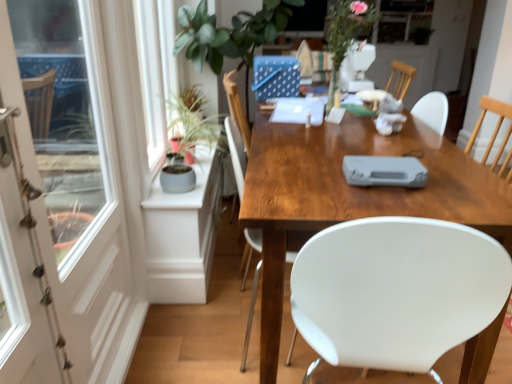
This screenshot has height=384, width=512. What are the coordinates of `wooden desk at center` in the screenshot? It's located at (352, 195).

Describe the element at coordinates (81, 172) in the screenshot. I see `white glossy screen door at left, marked as the 2th screen door in a right-to-left arrangement` at that location.

You are a GUI agent. You are given a task and a screenshot of the screen. Output one action in this format:
    pyautogui.click(x=<x>, y=<y>)
    Task: Click on the white glossy screen door at left, marked as the 2th screen door in a right-to-left arrangement
    This screenshot has height=384, width=512.
    Given the screenshot: What is the action you would take?
    pyautogui.click(x=81, y=172)

Locate an element on the screen. This screenshot has width=512, height=384. white plastic game console at center is located at coordinates (384, 171).

Describe the element at coordinates (345, 35) in the screenshot. I see `floral arrangement at upper center` at that location.

Locate an element on the screen. This screenshot has width=512, height=384. metallic silver screen door at left, placed as the 2th screen door when sorted from left to right is located at coordinates (26, 212).

Is metallic silver screen door at left, placed as the 2th screen door when sorted from left to right, facing away from white plastic game console at center?

No, white plastic game console at center is not at the back of metallic silver screen door at left, placed as the 2th screen door when sorted from left to right.

Does point (40, 315) come behind point (349, 164)?

That is False.

From a real-world perspective, is metallic silver screen door at left, which is the 1th screen door from right to left, above or below white plastic game console at center?

Clearly, from a real-world perspective, metallic silver screen door at left, which is the 1th screen door from right to left, is below white plastic game console at center.

From the image's perspective, is white glossy screen door at left, marked as the 2th screen door in a right-to-left arrangement, under metallic silver screen door at left, placed as the 2th screen door when sorted from left to right?

No.

Are white glossy screen door at left, acting as the 1th screen door starting from the left, and metallic silver screen door at left, which is the 1th screen door from right to left, beside each other?

There is a gap between white glossy screen door at left, acting as the 1th screen door starting from the left, and metallic silver screen door at left, which is the 1th screen door from right to left.

Which of these two, white glossy screen door at left, acting as the 1th screen door starting from the left, or metallic silver screen door at left, placed as the 2th screen door when sorted from left to right, is thinner?

Thinner between the two is metallic silver screen door at left, placed as the 2th screen door when sorted from left to right.

Could you tell me if white glossy screen door at left, acting as the 1th screen door starting from the left, is turned towards metallic silver screen door at left, placed as the 2th screen door when sorted from left to right?

No, white glossy screen door at left, acting as the 1th screen door starting from the left, is not facing towards metallic silver screen door at left, placed as the 2th screen door when sorted from left to right.

How many degrees apart are the facing directions of white glossy screen door at left, acting as the 1th screen door starting from the left, and floral arrangement at upper center?

3.32 degrees.

Is point (30, 298) in front of point (371, 22)?

Yes.

Is white glossy screen door at left, marked as the 2th screen door in a right-to-left arrangement, oriented towards floral arrangement at upper center?

No, white glossy screen door at left, marked as the 2th screen door in a right-to-left arrangement, is not facing towards floral arrangement at upper center.

Is white glossy screen door at left, marked as the 2th screen door in a right-to-left arrangement, positioned beyond the bounds of floral arrangement at upper center?

Indeed, white glossy screen door at left, marked as the 2th screen door in a right-to-left arrangement, is completely outside floral arrangement at upper center.

Measure the distance from floral arrangement at upper center to white plastic game console at center.

floral arrangement at upper center and white plastic game console at center are 91.11 centimeters apart.

From a real-world perspective, does floral arrangement at upper center stand above white plastic game console at center?

Yes, from a real-world perspective, floral arrangement at upper center is on top of white plastic game console at center.

Is floral arrangement at upper center positioned before white plastic game console at center?

No, floral arrangement at upper center is behind white plastic game console at center.

How different are the orientations of floral arrangement at upper center and white plastic game console at center in degrees?

94.6 degrees separate the facing orientations of floral arrangement at upper center and white plastic game console at center.

Is metallic silver screen door at left, which is the 1th screen door from right to left, further to the viewer compared to white glossy screen door at left, marked as the 2th screen door in a right-to-left arrangement?

That is True.

How different are the orientations of metallic silver screen door at left, which is the 1th screen door from right to left, and white glossy screen door at left, acting as the 1th screen door starting from the left, in degrees?

They differ by 1.24 degrees in their facing directions.

The width and height of the screenshot is (512, 384). I want to click on screen door lying in front of the metallic silver screen door at left, which is the 1th screen door from right to left, so click(81, 172).

Does metallic silver screen door at left, placed as the 2th screen door when sorted from left to right, have a greater width compared to floral arrangement at upper center?

No.

Which is farther from the camera, (x=5, y=221) or (x=348, y=44)?

The point (x=348, y=44) is farther.

Is metallic silver screen door at left, placed as the 2th screen door when sorted from left to right, spatially inside floral arrangement at upper center, or outside of it?

metallic silver screen door at left, placed as the 2th screen door when sorted from left to right, is not enclosed by floral arrangement at upper center.

Visually, is floral arrangement at upper center positioned to the left or to the right of metallic silver screen door at left, which is the 1th screen door from right to left?

floral arrangement at upper center is to the right of metallic silver screen door at left, which is the 1th screen door from right to left.

From a real-world perspective, is floral arrangement at upper center positioned above or below metallic silver screen door at left, which is the 1th screen door from right to left?

Clearly, from a real-world perspective, floral arrangement at upper center is above metallic silver screen door at left, which is the 1th screen door from right to left.

Measure the distance from floral arrangement at upper center to metallic silver screen door at left, placed as the 2th screen door when sorted from left to right.

The distance of floral arrangement at upper center from metallic silver screen door at left, placed as the 2th screen door when sorted from left to right, is 1.48 meters.

Is floral arrangement at upper center placed right next to metallic silver screen door at left, which is the 1th screen door from right to left?

No.

From a real-world perspective, which screen door is the 1st one underneath the white plastic game console at center? Please provide its 2D coordinates.

[(26, 212)]

In the image, there is a white glossy screen door at left, marked as the 2th screen door in a right-to-left arrangement. At what (x,y) coordinates should I click in order to perform the action: click on screen door below it (from the image's perspective). Please return your answer as a coordinate pair (x, y). The image size is (512, 384). Looking at the image, I should click on (26, 212).

Based on their spatial positions, is white plastic game console at center or white glossy screen door at left, acting as the 1th screen door starting from the left, closer to metallic silver screen door at left, which is the 1th screen door from right to left?

white glossy screen door at left, acting as the 1th screen door starting from the left, is closer to metallic silver screen door at left, which is the 1th screen door from right to left.

Based on their spatial positions, is white plastic game console at center or floral arrangement at upper center further from white glossy screen door at left, acting as the 1th screen door starting from the left?

floral arrangement at upper center lies further to white glossy screen door at left, acting as the 1th screen door starting from the left, than the other object.

Looking at the image, which one is located further to floral arrangement at upper center, white glossy screen door at left, marked as the 2th screen door in a right-to-left arrangement, or white plastic game console at center?

white glossy screen door at left, marked as the 2th screen door in a right-to-left arrangement, lies further to floral arrangement at upper center than the other object.

Which object lies further to the anchor point wooden desk at center, metallic silver screen door at left, placed as the 2th screen door when sorted from left to right, or white plastic game console at center?

The object further to wooden desk at center is metallic silver screen door at left, placed as the 2th screen door when sorted from left to right.

Based on their spatial positions, is white plastic game console at center or metallic silver screen door at left, which is the 1th screen door from right to left, further from white glossy screen door at left, acting as the 1th screen door starting from the left?

white plastic game console at center is further to white glossy screen door at left, acting as the 1th screen door starting from the left.

Looking at the image, which one is located further to floral arrangement at upper center, wooden desk at center or metallic silver screen door at left, placed as the 2th screen door when sorted from left to right?

Based on the image, metallic silver screen door at left, placed as the 2th screen door when sorted from left to right, appears to be further to floral arrangement at upper center.

Based on their spatial positions, is floral arrangement at upper center or white plastic game console at center closer to metallic silver screen door at left, placed as the 2th screen door when sorted from left to right?

white plastic game console at center lies closer to metallic silver screen door at left, placed as the 2th screen door when sorted from left to right, than the other object.

From the picture: Based on their spatial positions, is metallic silver screen door at left, which is the 1th screen door from right to left, or floral arrangement at upper center closer to white glossy screen door at left, marked as the 2th screen door in a right-to-left arrangement?

metallic silver screen door at left, which is the 1th screen door from right to left, is closer to white glossy screen door at left, marked as the 2th screen door in a right-to-left arrangement.

What are the coordinates of `screen door between white glossy screen door at left, marked as the 2th screen door in a right-to-left arrangement, and white plastic game console at center` in the screenshot? It's located at [x=26, y=212].

Find the location of a particular element. desk between white glossy screen door at left, marked as the 2th screen door in a right-to-left arrangement, and floral arrangement at upper center, in the horizontal direction is located at coordinates (352, 195).

At what (x,y) coordinates should I click in order to perform the action: click on tableware between metallic silver screen door at left, which is the 1th screen door from right to left, and floral arrangement at upper center, in the horizontal direction. Please return your answer as a coordinate pair (x, y). The image size is (512, 384). Looking at the image, I should click on (384, 171).

This screenshot has height=384, width=512. I want to click on tableware between metallic silver screen door at left, placed as the 2th screen door when sorted from left to right, and wooden desk at center from left to right, so click(384, 171).